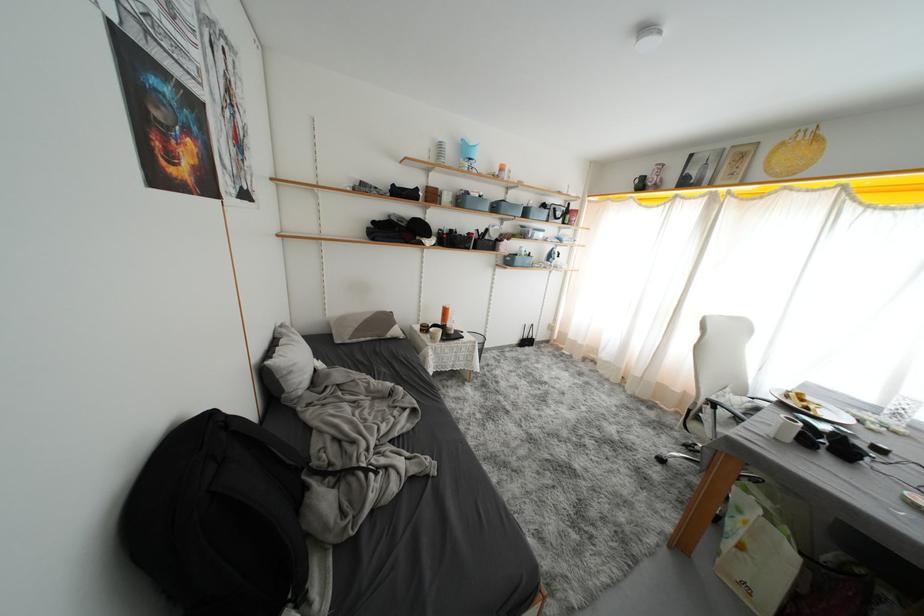
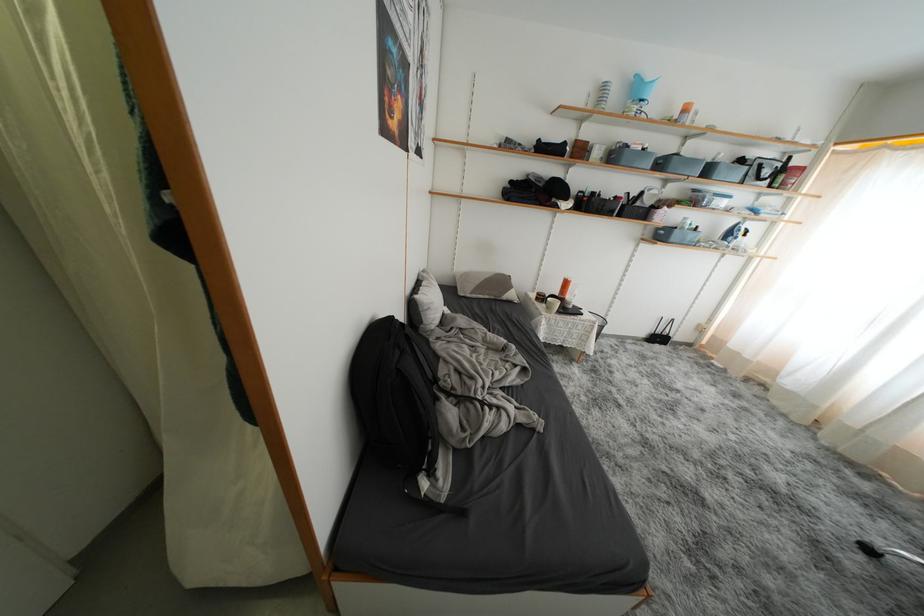
Find the pixel in the second image that matches (392,323) in the first image.

(508, 286)